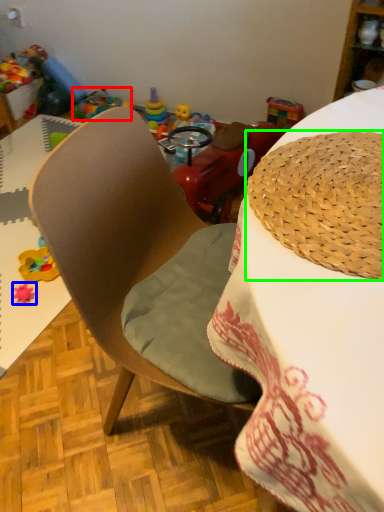
Question: Considering the real-world distances, which object is farthest from toy (highlighted by a red box)? toy (highlighted by a blue box) or hat (highlighted by a green box)?

Choices:
 (A) toy
 (B) hat

Answer: (B)